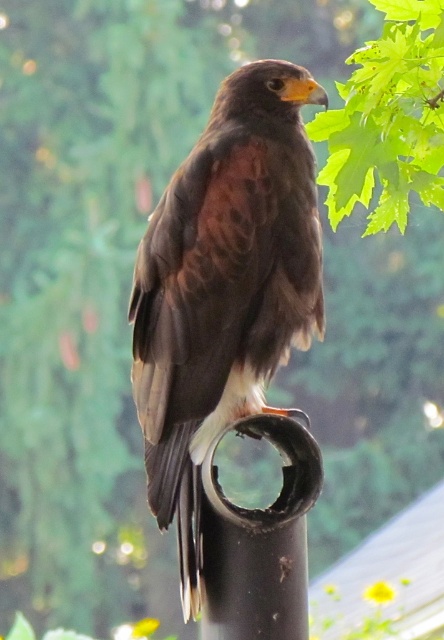
You are a photographer trying to capture the brown feathered eagle at center and the black matte pipe at center in a single shot. Based on their sizes, which object will occupy more space in your photo?

The brown feathered eagle at center has a larger size compared to the black matte pipe at center, so it will occupy more space in the photo.

In the scene shown: You are an architect designing a bird sanctuary and need to place two markers at the coordinates point [229,365] and point [282,440]. Which marker is closer to the bird perched on the black cylindrical object?

Point [229,365] is closer to the viewer than point [282,440], so the marker at point [229,365] will be closer to the bird perched on the black cylindrical object.